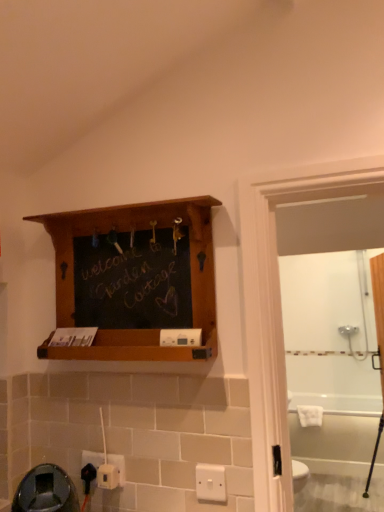
Question: Is white plastic electric outlet at lower left, placed as the second electric outlet when sorted from back to front, oriented away from white plastic/light switch at lower center?

Choices:
 (A) no
 (B) yes

Answer: (A)

Question: From a real-world perspective, does white plastic electric outlet at lower left, the second electric outlet positioned from the front, sit lower than white plastic/light switch at lower center?

Choices:
 (A) yes
 (B) no

Answer: (B)

Question: Is white plastic electric outlet at lower left, placed as the second electric outlet when sorted from back to front, shorter than white plastic/light switch at lower center?

Choices:
 (A) yes
 (B) no

Answer: (A)

Question: Is white plastic electric outlet at lower left, placed as the second electric outlet when sorted from back to front, next to white plastic/light switch at lower center and touching it?

Choices:
 (A) no
 (B) yes

Answer: (A)

Question: Is white plastic electric outlet at lower left, the second electric outlet positioned from the front, smaller than white plastic/light switch at lower center?

Choices:
 (A) no
 (B) yes

Answer: (A)

Question: Does white plastic electric outlet at lower left, placed as the second electric outlet when sorted from back to front, come behind white plastic/light switch at lower center?

Choices:
 (A) no
 (B) yes

Answer: (B)

Question: Considering the relative positions of white plastic/light switch at lower center and wooden shelf at upper center in the image provided, is white plastic/light switch at lower center to the right of wooden shelf at upper center from the viewer's perspective?

Choices:
 (A) no
 (B) yes

Answer: (B)

Question: Is white plastic/light switch at lower center shorter than wooden shelf at upper center?

Choices:
 (A) no
 (B) yes

Answer: (B)

Question: From a real-world perspective, is white plastic/light switch at lower center positioned over wooden shelf at upper center based on gravity?

Choices:
 (A) yes
 (B) no

Answer: (B)

Question: Does white plastic/light switch at lower center have a larger size compared to wooden shelf at upper center?

Choices:
 (A) no
 (B) yes

Answer: (A)

Question: Does white plastic/light switch at lower center come behind wooden shelf at upper center?

Choices:
 (A) no
 (B) yes

Answer: (B)

Question: Is white plastic/light switch at lower center far from wooden shelf at upper center?

Choices:
 (A) no
 (B) yes

Answer: (A)

Question: From the image's perspective, would you say white glossy bathtub at lower right is positioned over white plastic electric outlet at lower left, the second electric outlet positioned from the front?

Choices:
 (A) no
 (B) yes

Answer: (A)